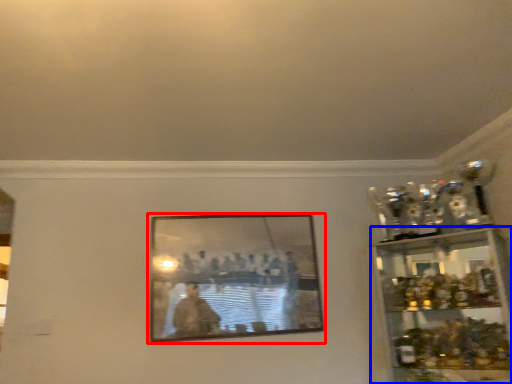
Question: Which object is closer to the camera taking this photo, picture frame (highlighted by a red box) or shelf (highlighted by a blue box)?

Choices:
 (A) picture frame
 (B) shelf

Answer: (B)